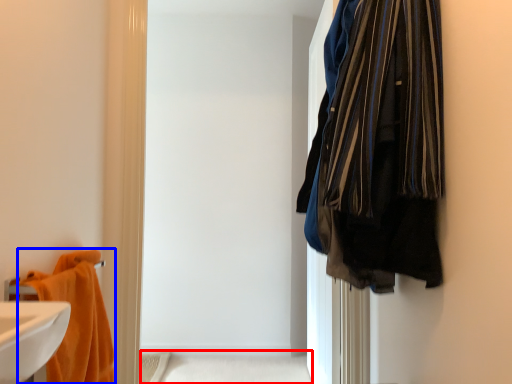
Question: Among these objects, which one is nearest to the camera, bath (highlighted by a red box) or towel (highlighted by a blue box)?

Choices:
 (A) bath
 (B) towel

Answer: (B)